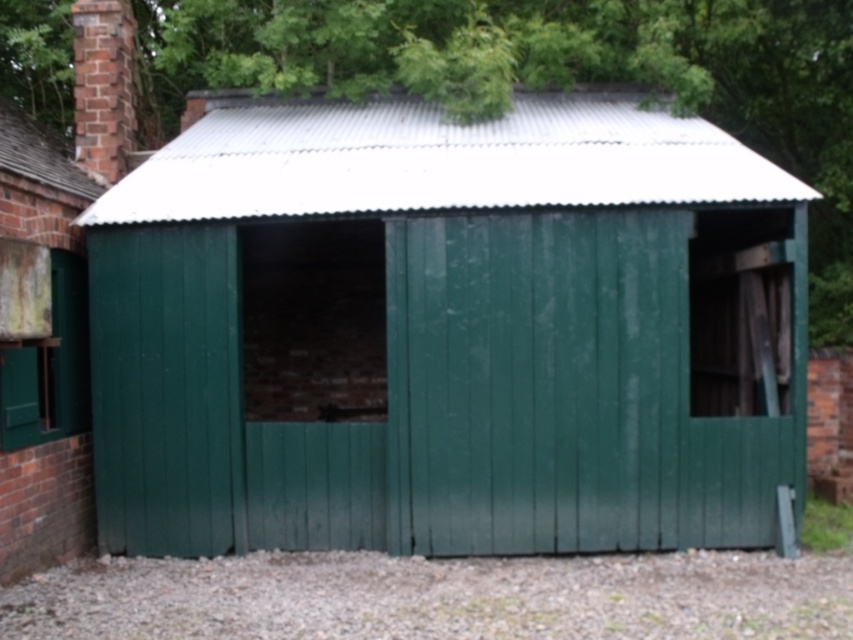
You are a delivery person trying to park your van near the green woodshed at center and the brick chimney at upper left. Since the van is 2 meters wide, can you fit it between them?

The green woodshed at center is bigger than brick chimney at upper left, so there might be enough space between them for the van. However, the exact distance isn not specified, so it is uncertain whether the van will fit.